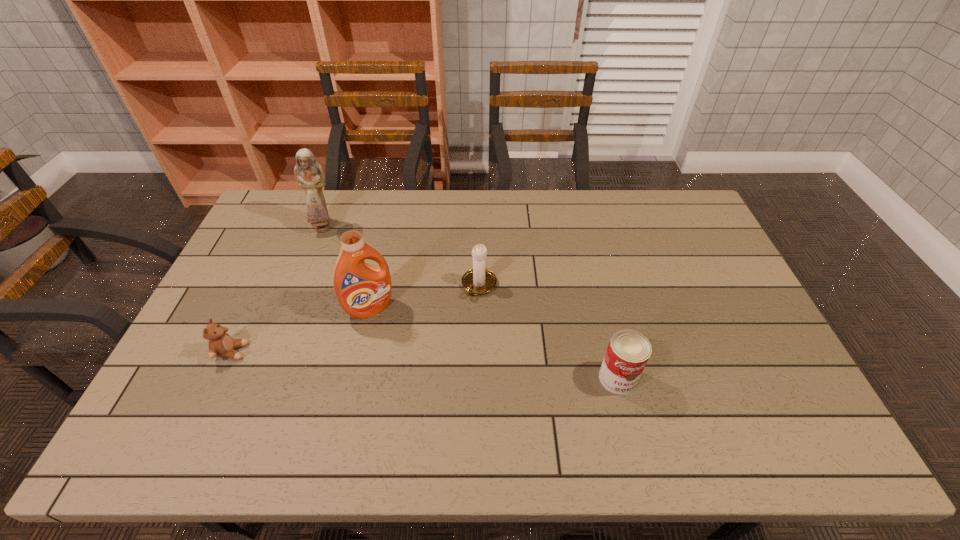
At what (x,y) coordinates should I click in order to perform the action: click on vacant position located 0.140m on the front-facing side of the detergent. Please return your answer as a coordinate pair (x, y). The width and height of the screenshot is (960, 540). Looking at the image, I should click on 401,354.

Image resolution: width=960 pixels, height=540 pixels. Find the location of `vacant space located on the front-facing side of the detergent`. vacant space located on the front-facing side of the detergent is located at coordinates (433, 406).

You are a GUI agent. You are given a task and a screenshot of the screen. Output one action in this format:
    pyautogui.click(x=<x>, y=<y>)
    Task: Click on the vacant space situated on the front-facing side of the farthest object
    The height and width of the screenshot is (540, 960).
    Given the screenshot: What is the action you would take?
    pyautogui.click(x=387, y=297)

The image size is (960, 540). I want to click on vacant space located 0.350m on the front-facing side of the farthest object, so click(382, 292).

Locate an element on the screen. This screenshot has height=540, width=960. vacant space located on the front-facing side of the farthest object is located at coordinates (362, 270).

Locate an element on the screen. The image size is (960, 540). blank space located 0.370m on the handle side of the candle holder is located at coordinates [x=400, y=397].

At what (x,y) coordinates should I click in order to perform the action: click on blank area located 0.260m on the handle side of the candle holder. Please return your answer as a coordinate pair (x, y). Looking at the image, I should click on (424, 364).

The image size is (960, 540). I want to click on vacant area situated on the handle side of the candle holder, so click(x=450, y=327).

Locate an element on the screen. This screenshot has width=960, height=540. object located in the far edge section of the desktop is located at coordinates (309, 174).

Where is `object that is positioned at the near edge`? This screenshot has width=960, height=540. object that is positioned at the near edge is located at coordinates (628, 351).